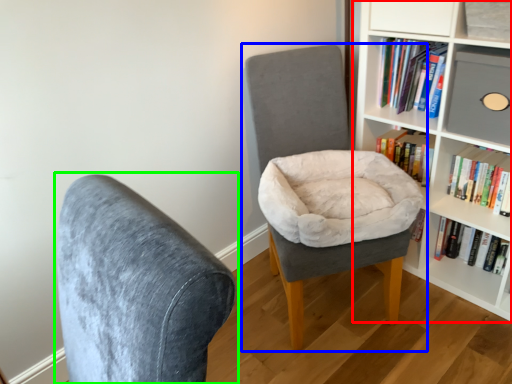
Question: Estimate the real-world distances between objects in this image. Which object is closer to bookcase (highlighted by a red box), chair (highlighted by a blue box) or chair (highlighted by a green box)?

Choices:
 (A) chair
 (B) chair

Answer: (A)